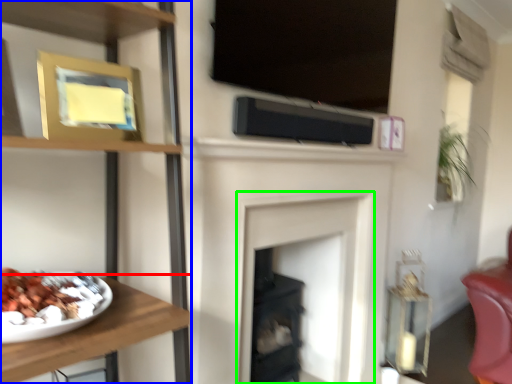
Question: Estimate the real-world distances between objects in this image. Which object is closer to furniture (highlighted by a red box), shelf (highlighted by a blue box) or fireplace (highlighted by a green box)?

Choices:
 (A) shelf
 (B) fireplace

Answer: (A)